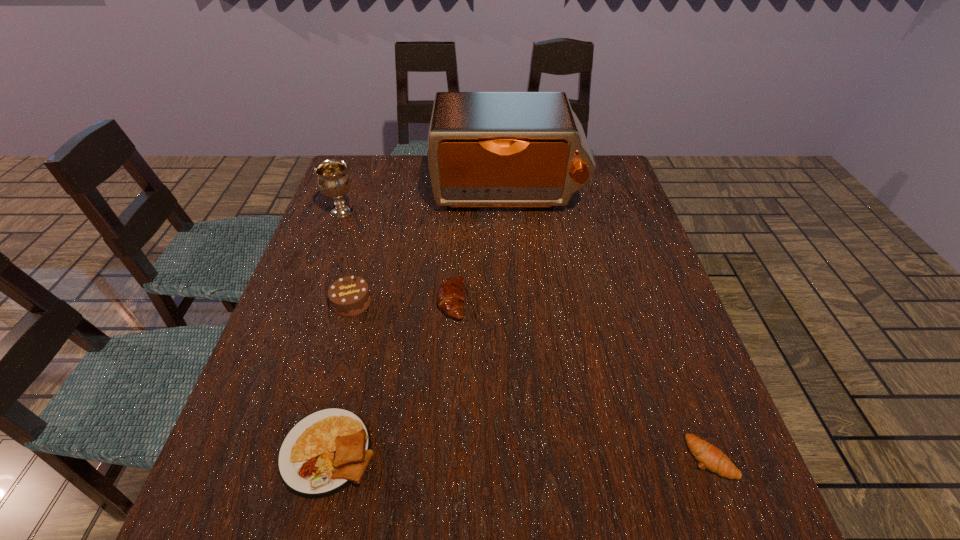
Identify the location of the tallest object. (485, 149).

In order to click on the leftmost object in this screenshot , I will do `click(333, 181)`.

Find the location of a particular element. chalice is located at coordinates (333, 181).

You are a GUI agent. You are given a task and a screenshot of the screen. Output one action in this format:
    pyautogui.click(x=<x>, y=<y>)
    Task: Click on the fourth shortest object
    This screenshot has width=960, height=540.
    Given the screenshot: What is the action you would take?
    click(x=349, y=296)

You are a GUI agent. You are given a task and a screenshot of the screen. Output one action in this format:
    pyautogui.click(x=<x>, y=<y>)
    Task: Click on the taller crescent roll
    
    Given the screenshot: What is the action you would take?
    pyautogui.click(x=451, y=296)

What are the coordinates of `the third shortest object` in the screenshot? It's located at click(451, 296).

Image resolution: width=960 pixels, height=540 pixels. I want to click on the right crescent roll, so click(x=710, y=457).

At what (x,y) coordinates should I click in order to perform the action: click on the rightmost object. Please return your answer as a coordinate pair (x, y). This screenshot has width=960, height=540. Looking at the image, I should click on (710, 457).

Image resolution: width=960 pixels, height=540 pixels. I want to click on omelet, so click(322, 454).

Image resolution: width=960 pixels, height=540 pixels. What are the coordinates of `free space located on the door side of the toaster oven` in the screenshot? It's located at click(x=517, y=324).